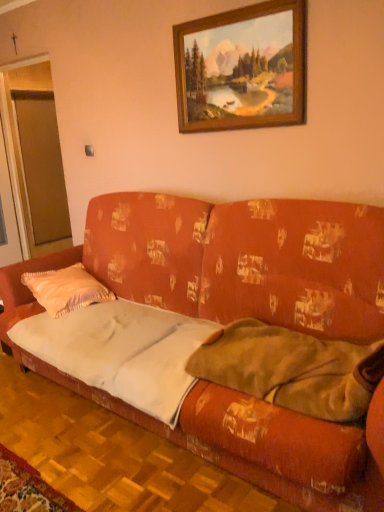
This screenshot has width=384, height=512. In order to click on vacant area on top of wooden picture frame at upper center (from a real-world perspective) in this screenshot , I will do `click(229, 7)`.